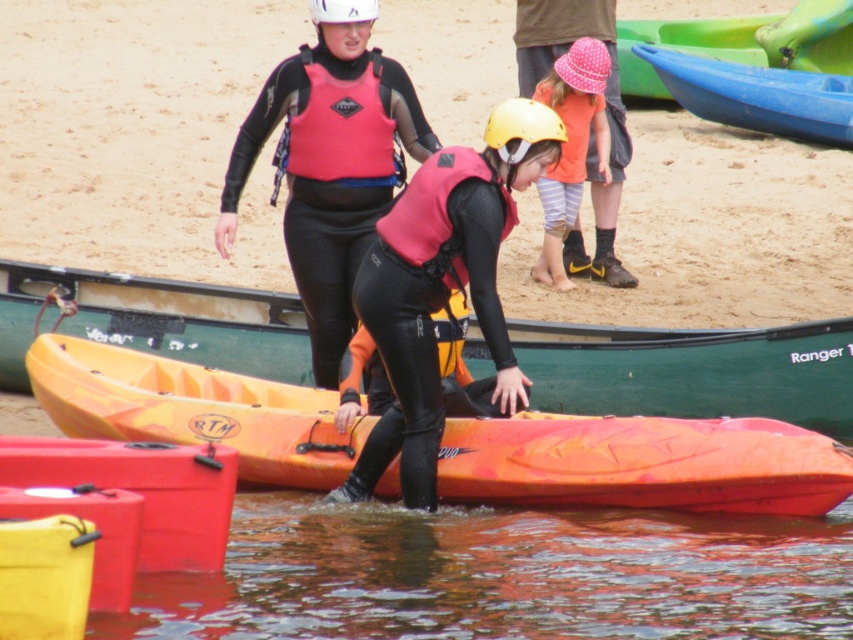
Who is lower down, matte pink life vest at center or yellow matte helmet at center?

matte pink life vest at center is below.

Between matte pink life vest at center and yellow matte helmet at center, which one appears on the left side from the viewer's perspective?

From the viewer's perspective, matte pink life vest at center appears more on the left side.

Measure the distance between matte pink life vest at center and camera.

A distance of 18.70 meters exists between matte pink life vest at center and camera.

Image resolution: width=853 pixels, height=640 pixels. What are the coordinates of `matte pink life vest at center` in the screenshot? It's located at (329, 170).

Is the position of orange plastic canoe at center less distant than that of orange cotton shirt at center?

Yes, it is in front of orange cotton shirt at center.

Is orange plastic canoe at center to the right of orange cotton shirt at center from the viewer's perspective?

Yes, orange plastic canoe at center is to the right of orange cotton shirt at center.

Who is more distant from viewer, (802, 506) or (582, 67)?

Point (582, 67)

The width and height of the screenshot is (853, 640). What are the coordinates of `orange plastic canoe at center` in the screenshot? It's located at (643, 464).

Does orange cotton shirt at center appear under white matte helmet at upper center?

Yes, orange cotton shirt at center is below white matte helmet at upper center.

Is orange cotton shirt at center thinner than white matte helmet at upper center?

Incorrect, orange cotton shirt at center's width is not less than white matte helmet at upper center's.

Which is behind, point (556, 269) or point (321, 22)?

The point (556, 269) is behind.

At what (x,y) coordinates should I click in order to perform the action: click on orange cotton shirt at center. Please return your answer as a coordinate pair (x, y). Image resolution: width=853 pixels, height=640 pixels. Looking at the image, I should click on (572, 147).